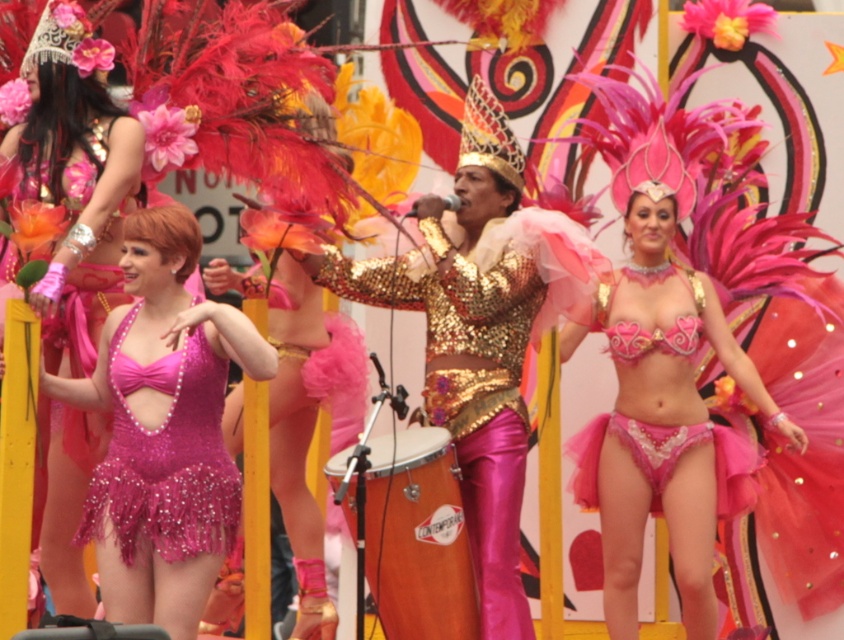
Does shiny sequined dress at left have a greater width compared to pink sequined bikini at center?

Yes.

Is point (230, 536) behind point (683, 330)?

No, (230, 536) is in front of (683, 330).

Describe the element at coordinates (163, 429) in the screenshot. I see `shiny sequined dress at left` at that location.

Where is `shiny sequined dress at left`? The width and height of the screenshot is (844, 640). shiny sequined dress at left is located at coordinates (163, 429).

Can you confirm if shiny sequined dress at left is positioned above shiny pink bikini at center?

Yes.

The image size is (844, 640). Describe the element at coordinates (163, 429) in the screenshot. I see `shiny sequined dress at left` at that location.

At what (x,y) coordinates should I click in order to perform the action: click on shiny sequined dress at left. Please return your answer as a coordinate pair (x, y). The width and height of the screenshot is (844, 640). Looking at the image, I should click on (163, 429).

Does shiny gold sequins at center have a lesser height compared to shiny sequined dress at left?

In fact, shiny gold sequins at center may be taller than shiny sequined dress at left.

How much distance is there between shiny gold sequins at center and shiny sequined dress at left?

10.50 meters

The image size is (844, 640). What do you see at coordinates (479, 332) in the screenshot? I see `shiny gold sequins at center` at bounding box center [479, 332].

Locate an element on the screen. This screenshot has height=640, width=844. shiny gold sequins at center is located at coordinates (479, 332).